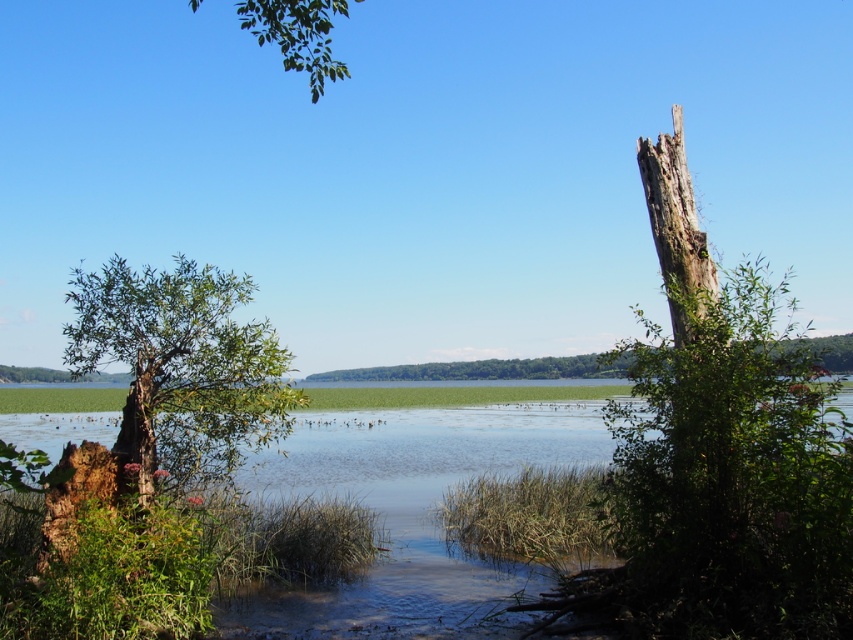
Is green grassy river at center shorter than green leafy branch at upper center?

Indeed, green grassy river at center has a lesser height compared to green leafy branch at upper center.

Does green grassy river at center appear on the left side of green leafy branch at upper center?

In fact, green grassy river at center is to the right of green leafy branch at upper center.

Which is behind, point (368, 620) or point (300, 52)?

The point (368, 620) is more distant.

Identify the location of green grassy river at center. The width and height of the screenshot is (853, 640). pos(418,499).

Between green leafy tree at left and green leafy branch at upper center, which one appears on the right side from the viewer's perspective?

green leafy tree at left

Can you confirm if green leafy tree at left is smaller than green leafy branch at upper center?

Yes, green leafy tree at left is smaller than green leafy branch at upper center.

Between point (248, 365) and point (286, 10), which one is positioned in front?

Point (286, 10) is in front.

This screenshot has height=640, width=853. I want to click on green leafy tree at left, so click(x=181, y=369).

Is green grassy river at center thinner than green leafy tree at left?

In fact, green grassy river at center might be wider than green leafy tree at left.

Who is more distant from viewer, (463, 465) or (207, 321)?

Positioned behind is point (463, 465).

Is point (260, 612) positioned behind point (184, 380)?

No, (260, 612) is in front of (184, 380).

This screenshot has width=853, height=640. I want to click on green grassy river at center, so click(x=418, y=499).